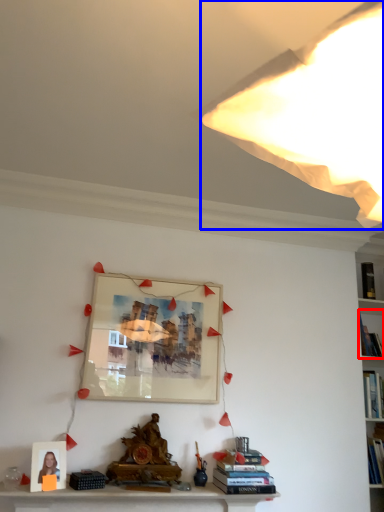
Question: Which object is closer to the camera taking this photo, book (highlighted by a red box) or light (highlighted by a blue box)?

Choices:
 (A) book
 (B) light

Answer: (B)